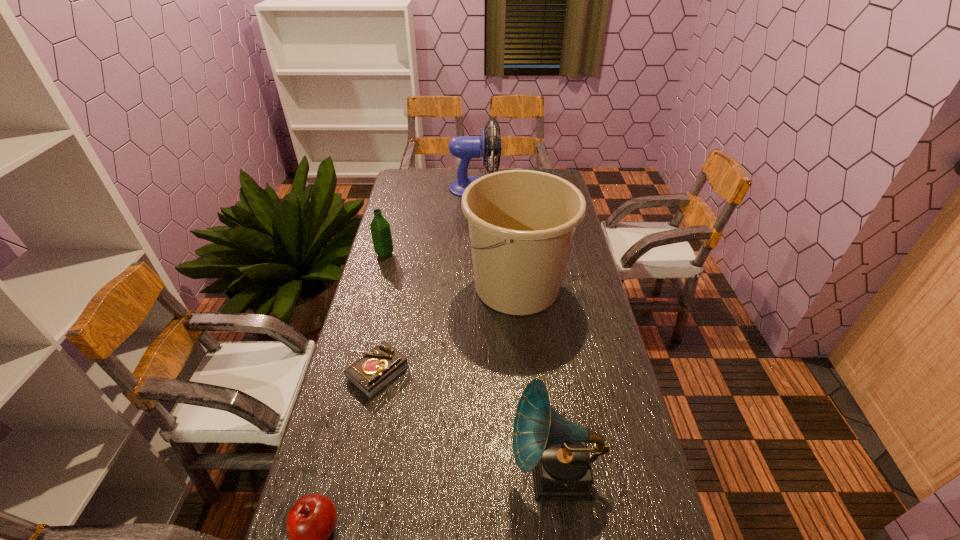
Find the location of a particular element. free spot that satisfies the following two spatial constraints: 1. in front of the bucket where the airflow is directed; 2. on the left side of the farthest object is located at coordinates (472, 286).

This screenshot has height=540, width=960. Identify the location of free space that satisfies the following two spatial constraints: 1. in front of the farthest object where the airflow is directed; 2. on the back side of the bucket. (472, 286).

Where is `vacant space that satisfies the following two spatial constraints: 1. in front of the farthest object where the airflow is directed; 2. on the right side of the bucket`? This screenshot has height=540, width=960. vacant space that satisfies the following two spatial constraints: 1. in front of the farthest object where the airflow is directed; 2. on the right side of the bucket is located at coordinates (472, 286).